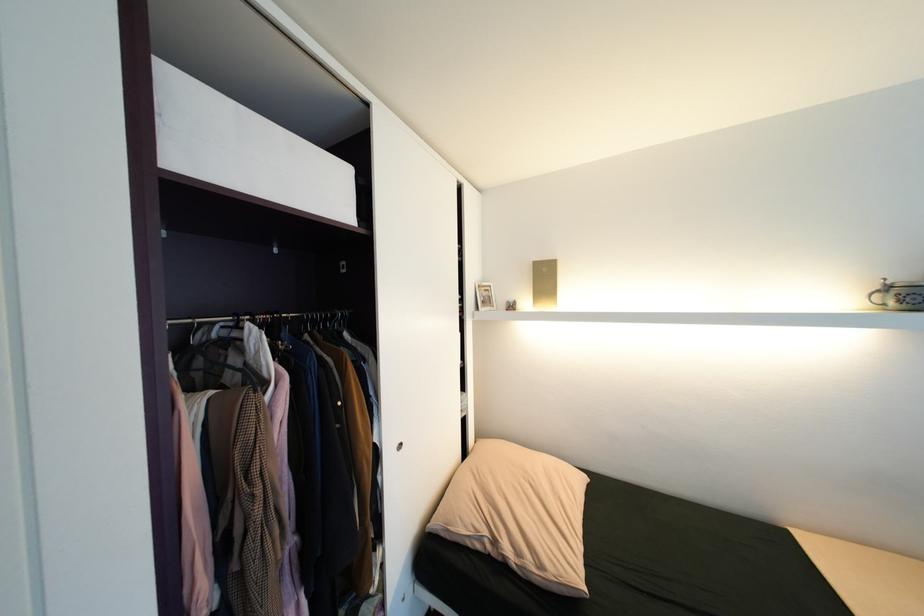
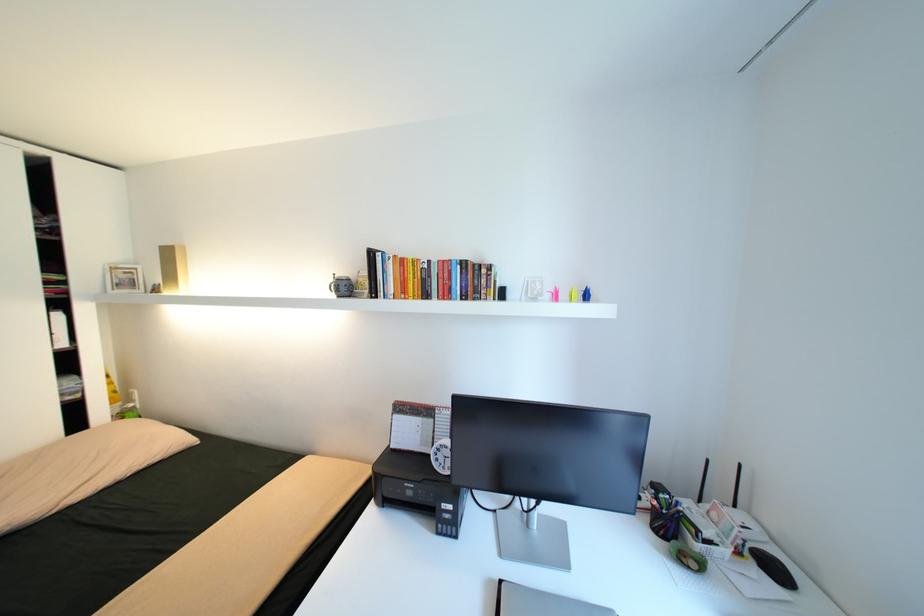
Locate, in the second image, the point that corresponds to point 517,301 in the first image.

(164, 284)